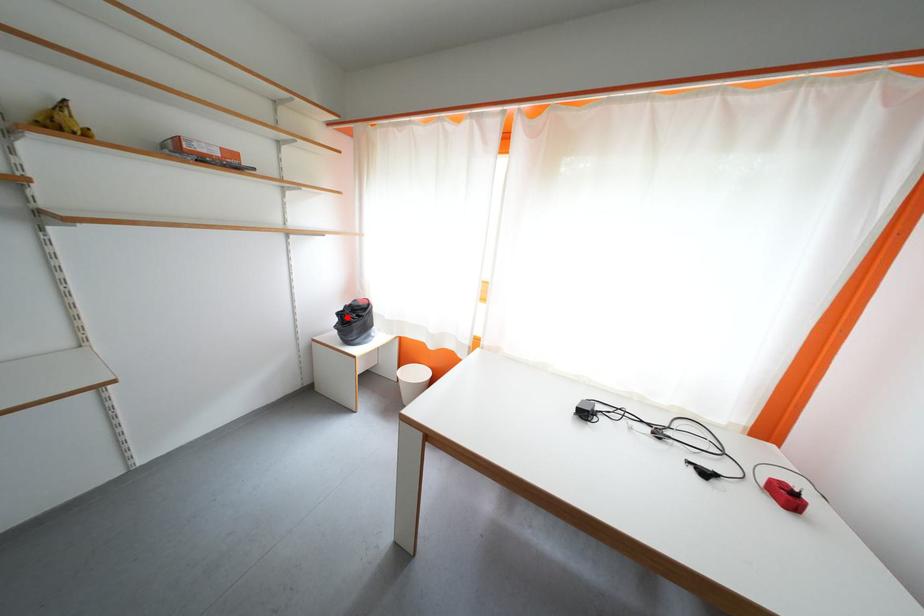
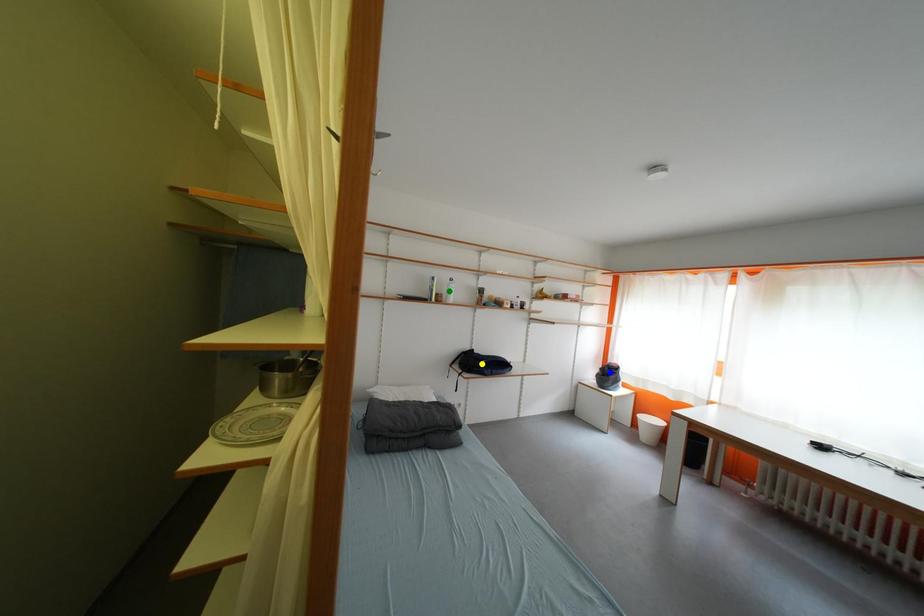
Question: I am providing you with two images of the same scene from different viewpoints. A red point is marked on the first image. You are given multiple points on the second image. Which mark in image 2 goes with the point in image 1?

Choices:
 (A) yellow point
 (B) green point
 (C) blue point

Answer: (C)